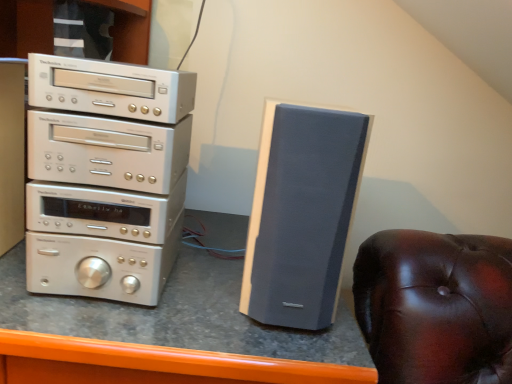
Question: Is matte gray speaker at right a part of silver metallic stereo stack at left?

Choices:
 (A) yes
 (B) no

Answer: (B)

Question: Is silver metallic stereo stack at left not close to matte gray speaker at right?

Choices:
 (A) no
 (B) yes

Answer: (A)

Question: Is silver metallic stereo stack at left to the left of matte gray speaker at right from the viewer's perspective?

Choices:
 (A) no
 (B) yes

Answer: (B)

Question: Is the depth of silver metallic stereo stack at left greater than that of matte gray speaker at right?

Choices:
 (A) no
 (B) yes

Answer: (B)

Question: From the image's perspective, does silver metallic stereo stack at left appear lower than matte gray speaker at right?

Choices:
 (A) yes
 (B) no

Answer: (B)

Question: Can you confirm if silver metallic stereo stack at left is bigger than matte gray speaker at right?

Choices:
 (A) yes
 (B) no

Answer: (A)

Question: Can you see silver metallic stereo stack at left touching matte gray speaker at center?

Choices:
 (A) no
 (B) yes

Answer: (A)

Question: Is matte gray speaker at center a part of silver metallic stereo stack at left?

Choices:
 (A) yes
 (B) no

Answer: (B)

Question: Does silver metallic stereo stack at left have a lesser height compared to matte gray speaker at center?

Choices:
 (A) yes
 (B) no

Answer: (A)

Question: Does silver metallic stereo stack at left appear on the right side of matte gray speaker at center?

Choices:
 (A) yes
 (B) no

Answer: (A)

Question: From a real-world perspective, does silver metallic stereo stack at left sit lower than matte gray speaker at center?

Choices:
 (A) no
 (B) yes

Answer: (A)

Question: Is matte gray speaker at center at the back of silver metallic stereo stack at left?

Choices:
 (A) no
 (B) yes

Answer: (A)

Question: Is silver metallic stereo stack at left inside matte gray speaker at right?

Choices:
 (A) yes
 (B) no

Answer: (B)